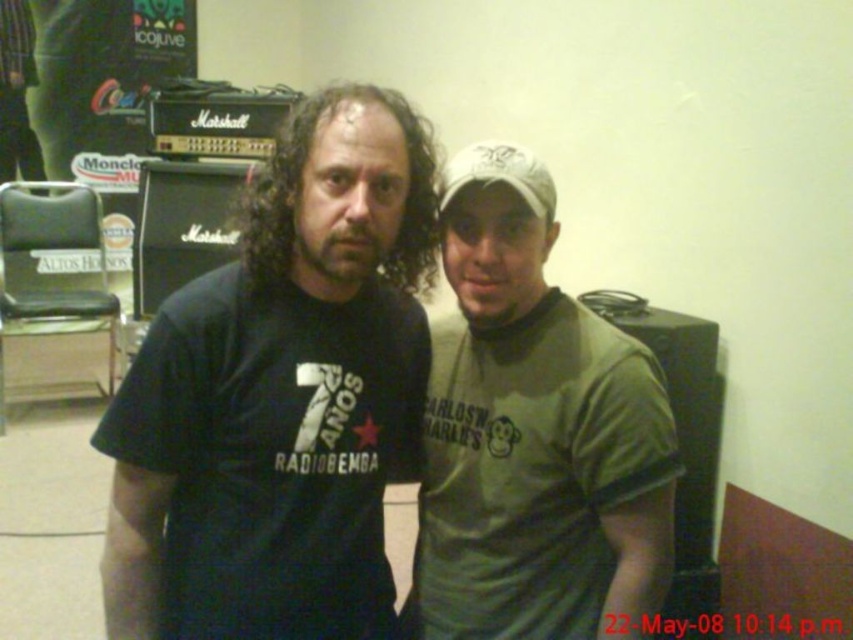
Between black matte t-shirt at center and white matte baseball hat at upper center, which one is positioned higher?

white matte baseball hat at upper center

Which is in front, point (370, 378) or point (480, 154)?

Positioned in front is point (480, 154).

Where is `black matte t-shirt at center`? black matte t-shirt at center is located at coordinates (281, 396).

In order to click on black matte t-shirt at center in this screenshot , I will do coord(281,396).

In order to click on black matte t-shirt at center in this screenshot , I will do `click(281, 396)`.

Does black matte t-shirt at center appear under green fabric pants at left?

Correct, black matte t-shirt at center is located below green fabric pants at left.

Who is more forward, (265, 451) or (10, 148)?

Positioned in front is point (265, 451).

Find the location of a particular element. This screenshot has width=853, height=640. black matte t-shirt at center is located at coordinates (281, 396).

Does green matte t-shirt at center come behind white matte baseball hat at upper center?

No, it is not.

Which is below, green matte t-shirt at center or white matte baseball hat at upper center?

green matte t-shirt at center

You are a GUI agent. You are given a task and a screenshot of the screen. Output one action in this format:
    pyautogui.click(x=<x>, y=<y>)
    Task: Click on the green matte t-shirt at center
    Image resolution: width=853 pixels, height=640 pixels.
    Given the screenshot: What is the action you would take?
    pyautogui.click(x=532, y=435)